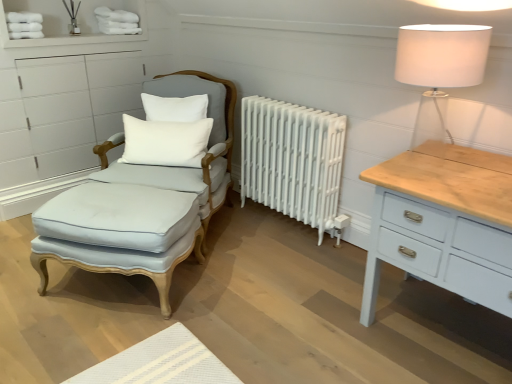
The height and width of the screenshot is (384, 512). What are the coordinates of `free space to the left of white painted metal radiator at center` in the screenshot? It's located at (241, 231).